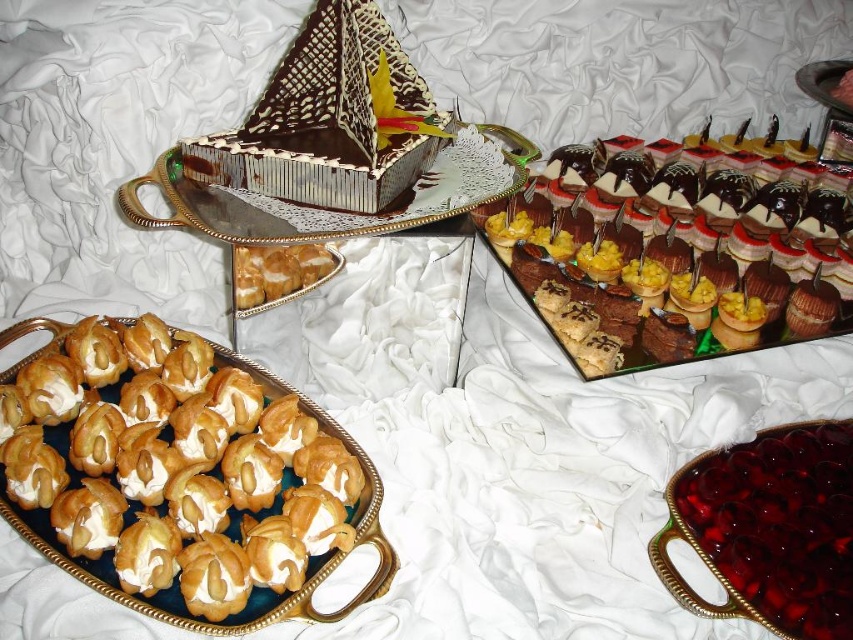
Which is more to the left, chocolate-coated pastry at upper right or golden puff pastry at left?

golden puff pastry at left

Is chocolate-coated pastry at upper right above golden puff pastry at left?

Correct, chocolate-coated pastry at upper right is located above golden puff pastry at left.

Is point (544, 300) positioned after point (293, 252)?

Yes, it is behind point (293, 252).

At what (x,y) coordinates should I click in order to perform the action: click on chocolate-coated pastry at upper right. Please return your answer as a coordinate pair (x, y). The image size is (853, 640). Looking at the image, I should click on (672, 256).

Which of these two, chocolate-coated pastry at upper right or golden cream puff at lower left, stands shorter?

golden cream puff at lower left is shorter.

Is chocolate-coated pastry at upper right thinner than golden cream puff at lower left?

Incorrect, chocolate-coated pastry at upper right's width is not less than golden cream puff at lower left's.

Is point (573, 301) more distant than point (120, 596)?

Yes, point (573, 301) is farther from viewer.

You are a GUI agent. You are given a task and a screenshot of the screen. Output one action in this format:
    pyautogui.click(x=<x>, y=<y>)
    Task: Click on the chocolate-coated pastry at upper right
    The width and height of the screenshot is (853, 640).
    Given the screenshot: What is the action you would take?
    pyautogui.click(x=672, y=256)

Locate an element on the screen. The height and width of the screenshot is (640, 853). chocolate-coated cake at upper center is located at coordinates (334, 209).

From the picture: Can you confirm if chocolate-coated cake at upper center is positioned above golden cream puff at lower left?

Indeed, chocolate-coated cake at upper center is positioned over golden cream puff at lower left.

From the picture: Measure the distance between chocolate-coated cake at upper center and camera.

They are 35.60 inches apart.

Find the location of `chocolate-coated cake at upper center`. chocolate-coated cake at upper center is located at coordinates (334, 209).